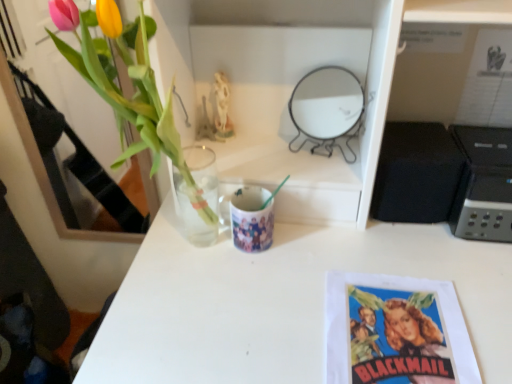
Question: Does translucent glass vase at upper left appear on the right side of printed paper poster at lower right?

Choices:
 (A) yes
 (B) no

Answer: (B)

Question: Are translucent glass vase at upper left and printed paper poster at lower right located far from each other?

Choices:
 (A) yes
 (B) no

Answer: (B)

Question: Considering the relative positions of translucent glass vase at upper left and printed paper poster at lower right in the image provided, is translucent glass vase at upper left to the left of printed paper poster at lower right from the viewer's perspective?

Choices:
 (A) no
 (B) yes

Answer: (B)

Question: Are translucent glass vase at upper left and printed paper poster at lower right making contact?

Choices:
 (A) no
 (B) yes

Answer: (A)

Question: From a real-world perspective, is translucent glass vase at upper left below printed paper poster at lower right?

Choices:
 (A) yes
 (B) no

Answer: (B)

Question: Is black plastic printer at right inside or outside of printed paper poster at lower right?

Choices:
 (A) inside
 (B) outside

Answer: (B)

Question: In the image, is black plastic printer at right positioned in front of or behind printed paper poster at lower right?

Choices:
 (A) behind
 (B) front

Answer: (A)

Question: From the image's perspective, is black plastic printer at right positioned above or below printed paper poster at lower right?

Choices:
 (A) below
 (B) above

Answer: (B)

Question: From a real-world perspective, is black plastic printer at right above or below printed paper poster at lower right?

Choices:
 (A) below
 (B) above

Answer: (B)

Question: Does point (97, 72) appear closer or farther from the camera than point (501, 236)?

Choices:
 (A) closer
 (B) farther

Answer: (A)

Question: From the image's perspective, relative to black plastic printer at right, is translucent glass vase at upper left above or below?

Choices:
 (A) below
 (B) above

Answer: (B)

Question: Looking at their shapes, would you say translucent glass vase at upper left is wider or thinner than black plastic printer at right?

Choices:
 (A) thin
 (B) wide

Answer: (A)

Question: In terms of size, does translucent glass vase at upper left appear bigger or smaller than black plastic printer at right?

Choices:
 (A) big
 (B) small

Answer: (A)

Question: Based on their sizes in the image, would you say black matte speaker at right is bigger or smaller than translucent glass vase at upper left?

Choices:
 (A) big
 (B) small

Answer: (B)

Question: Choose the correct answer: Is black matte speaker at right inside translucent glass vase at upper left or outside it?

Choices:
 (A) outside
 (B) inside

Answer: (A)